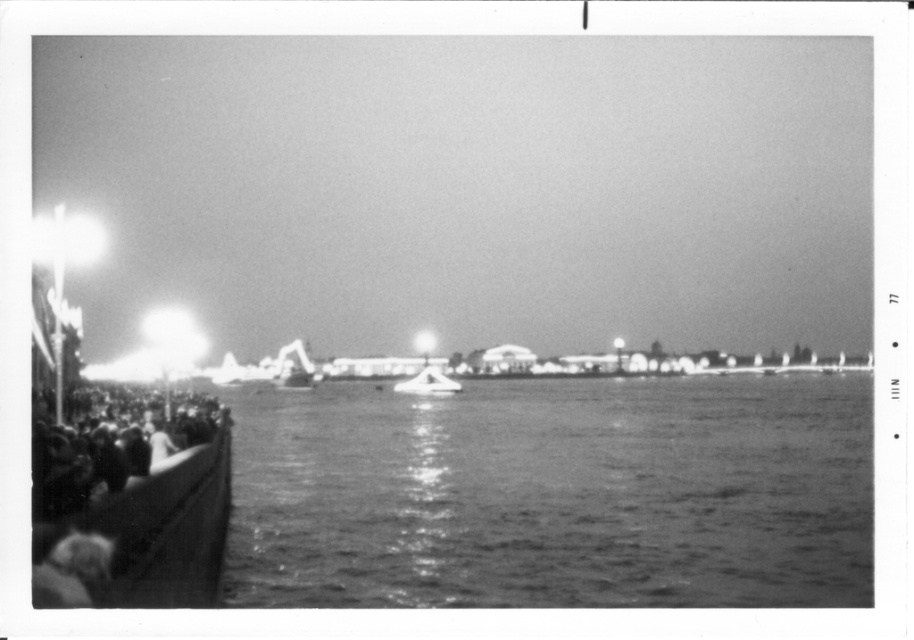
Who is lower down, smooth water at center or metallic silver boat at center?

smooth water at center is below.

Between point (416, 483) and point (416, 376), which one is positioned in front?

Point (416, 483)

Does point (780, 458) come closer to viewer compared to point (420, 374)?

Yes.

Where is `smooth water at center`? This screenshot has height=640, width=914. smooth water at center is located at coordinates (555, 493).

Is dark gray textured crowd at left positioned before metallic silver boat at center?

Yes, it is.

Which is more to the right, dark gray textured crowd at left or metallic silver boat at center?

Positioned to the right is metallic silver boat at center.

Is point (184, 547) more distant than point (412, 390)?

No, it is in front of (412, 390).

Locate an element on the screen. dark gray textured crowd at left is located at coordinates 130,506.

Does smooth water at center appear over dark gray textured crowd at left?

Actually, smooth water at center is below dark gray textured crowd at left.

In the scene shown: Does smooth water at center have a smaller size compared to dark gray textured crowd at left?

Actually, smooth water at center might be larger than dark gray textured crowd at left.

The width and height of the screenshot is (914, 640). What do you see at coordinates (555, 493) in the screenshot? I see `smooth water at center` at bounding box center [555, 493].

The width and height of the screenshot is (914, 640). Find the location of `smooth water at center`. smooth water at center is located at coordinates (555, 493).